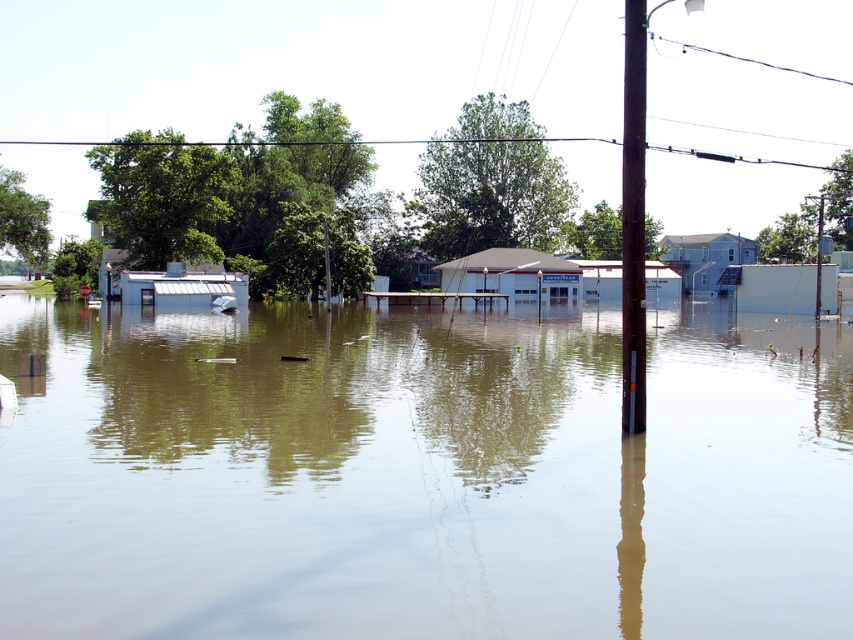
Measure the distance from brown murky water at center to smooth brown wooden pole at center.

brown murky water at center and smooth brown wooden pole at center are 91.51 feet apart from each other.

Image resolution: width=853 pixels, height=640 pixels. In order to click on brown murky water at center in this screenshot , I will do `click(421, 476)`.

Is brown murky water at center thinner than brown wooden pole at center?

Incorrect, brown murky water at center's width is not less than brown wooden pole at center's.

Who is more distant from viewer, (352, 433) or (633, 413)?

Positioned behind is point (352, 433).

At what (x,y) coordinates should I click in order to perform the action: click on brown murky water at center. Please return your answer as a coordinate pair (x, y). Looking at the image, I should click on (421, 476).

Is point (641, 397) positioned after point (819, 202)?

No, it is in front of (819, 202).

Between brown wooden pole at center and smooth brown wooden pole at center, which one is positioned lower?

brown wooden pole at center

Measure the distance between point (x=628, y=410) and camera.

Point (x=628, y=410) and camera are 44.53 feet apart from each other.

I want to click on brown wooden pole at center, so [x=633, y=220].